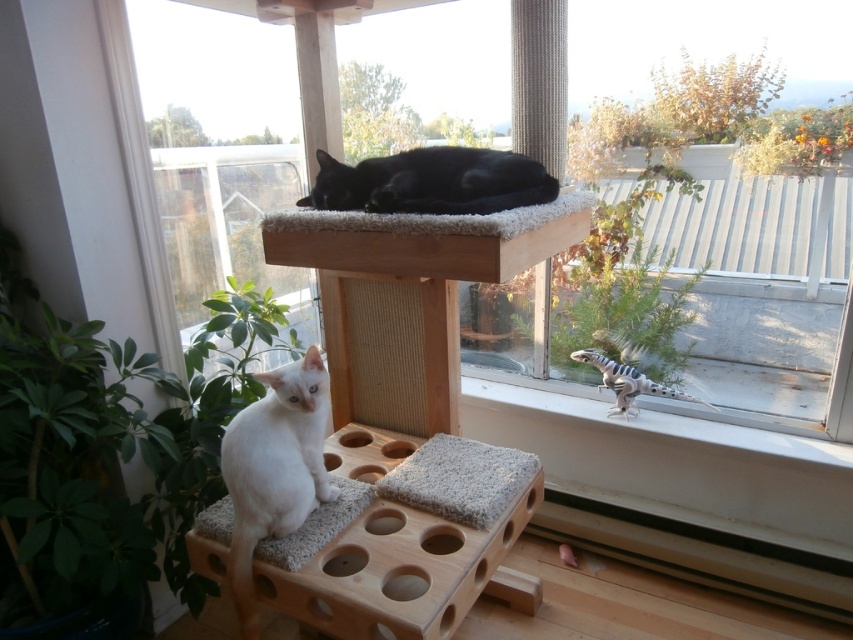
Question: Is white fluffy cat at lower left thinner than black fur cat at upper center?

Choices:
 (A) yes
 (B) no

Answer: (A)

Question: Which point is closer to the camera taking this photo?

Choices:
 (A) (305, 468)
 (B) (486, 156)

Answer: (A)

Question: Among these objects, which one is nearest to the camera?

Choices:
 (A) black fur cat at upper center
 (B) white fluffy cat at lower left

Answer: (B)

Question: Is white fluffy cat at lower left wider than black fur cat at upper center?

Choices:
 (A) yes
 (B) no

Answer: (B)

Question: Is white fluffy cat at lower left positioned in front of black fur cat at upper center?

Choices:
 (A) yes
 (B) no

Answer: (A)